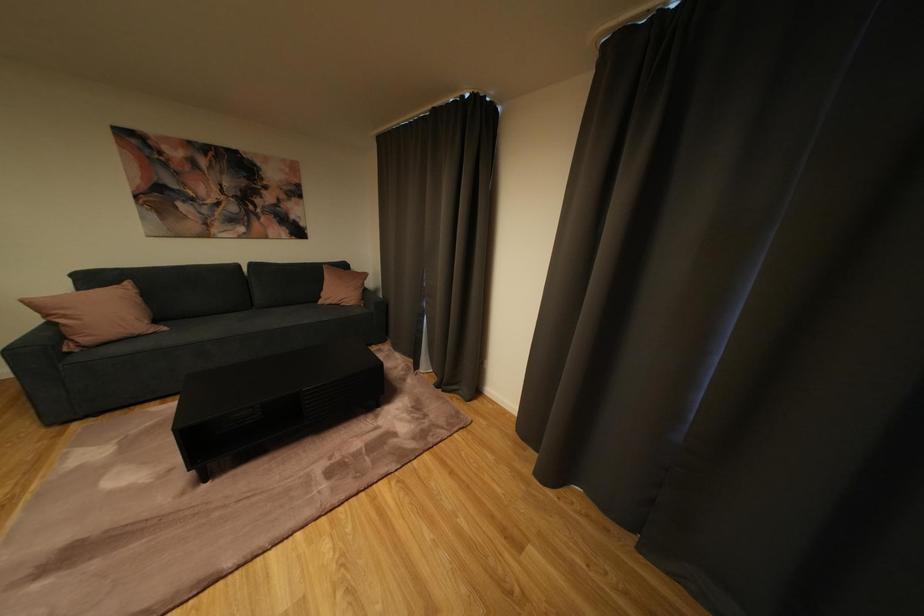
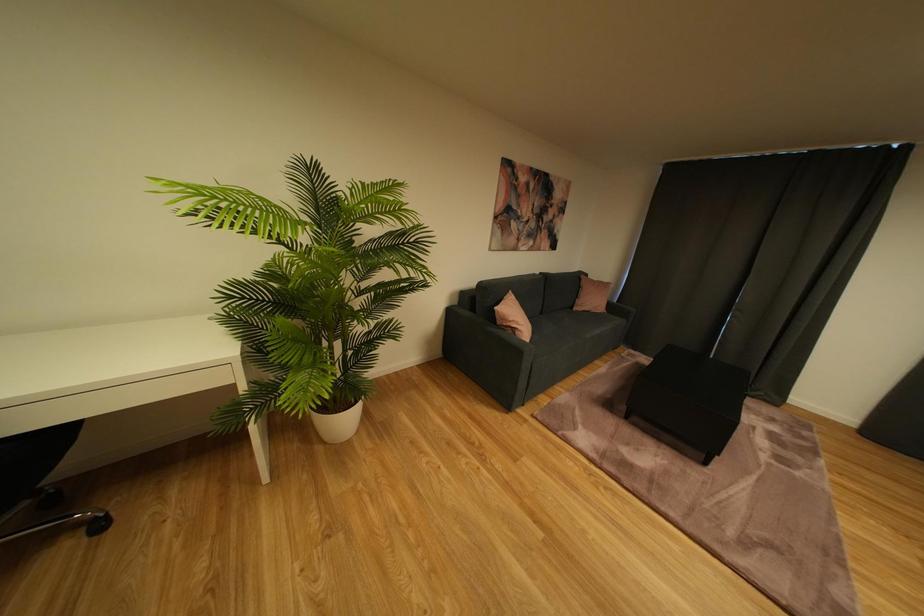
Question: In a continuous first-person perspective shot, in which direction is the camera moving?

Choices:
 (A) Left
 (B) Right
 (C) Forward
 (D) Backward

Answer: (A)